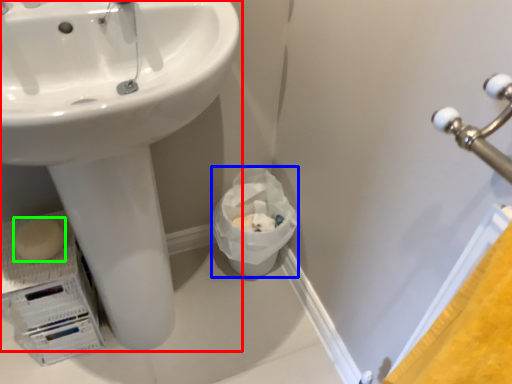
Question: Based on their relative distances, which object is farther from sink (highlighted by a red box)? Choose from garbage (highlighted by a blue box) and soap (highlighted by a green box).

Choices:
 (A) garbage
 (B) soap

Answer: (A)